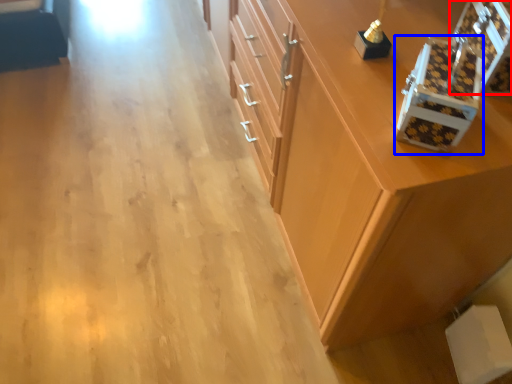
Question: Which point is further to the camera, box (highlighted by a red box) or box (highlighted by a blue box)?

Choices:
 (A) box
 (B) box

Answer: (A)